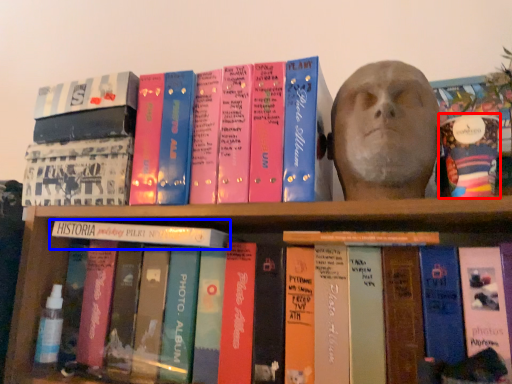
Question: Among these objects, which one is nearest to the camera, paperback book (highlighted by a red box) or book (highlighted by a blue box)?

Choices:
 (A) paperback book
 (B) book

Answer: (A)